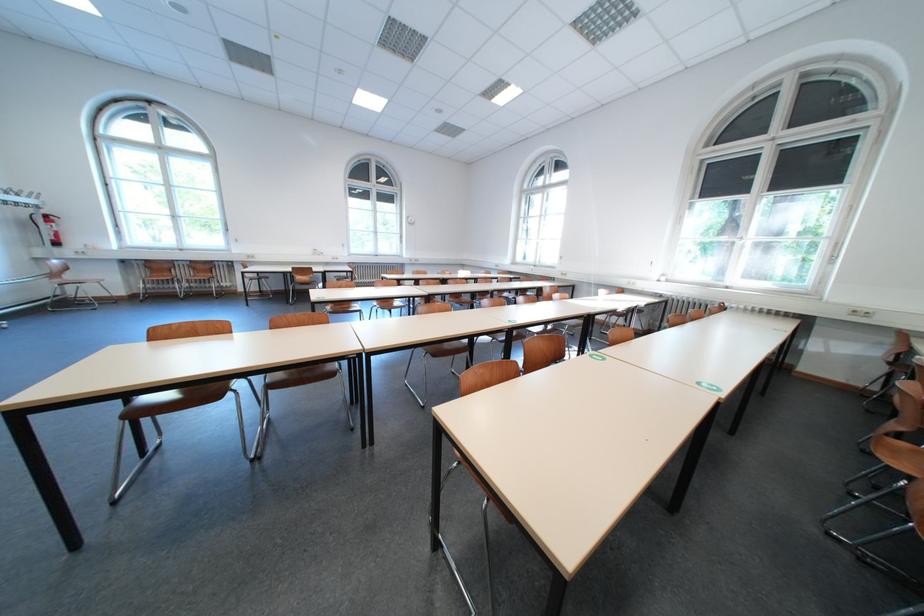
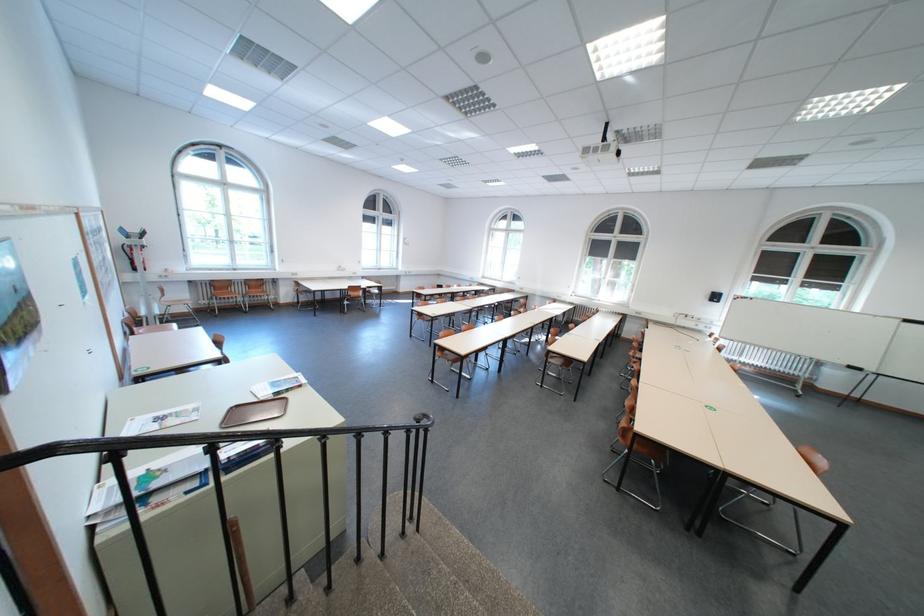
Question: I am providing you with two images of the same scene from different viewpoints. Please identify which objects are invisible in image2.

Choices:
 (A) brown tray
 (B) fire extinguisher handle
 (C) brown chair sitting surface
 (D) none of these

Answer: (D)